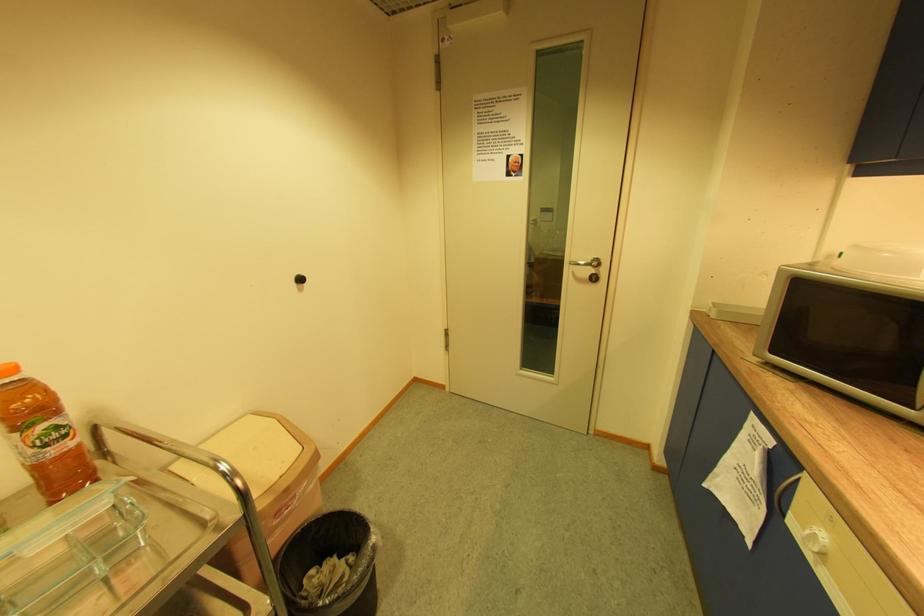
Find where to turn the silver door handle. Please return your answer as a coordinate pair (x, y).

(590, 267)